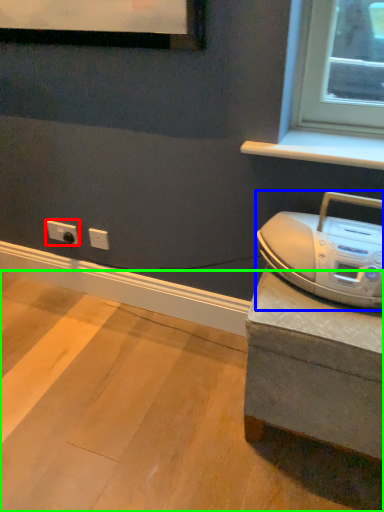
Question: Estimate the real-world distances between objects in this image. Which object is farther from electric outlet (highlighted by a red box), home appliance (highlighted by a blue box) or concrete (highlighted by a green box)?

Choices:
 (A) home appliance
 (B) concrete

Answer: (A)